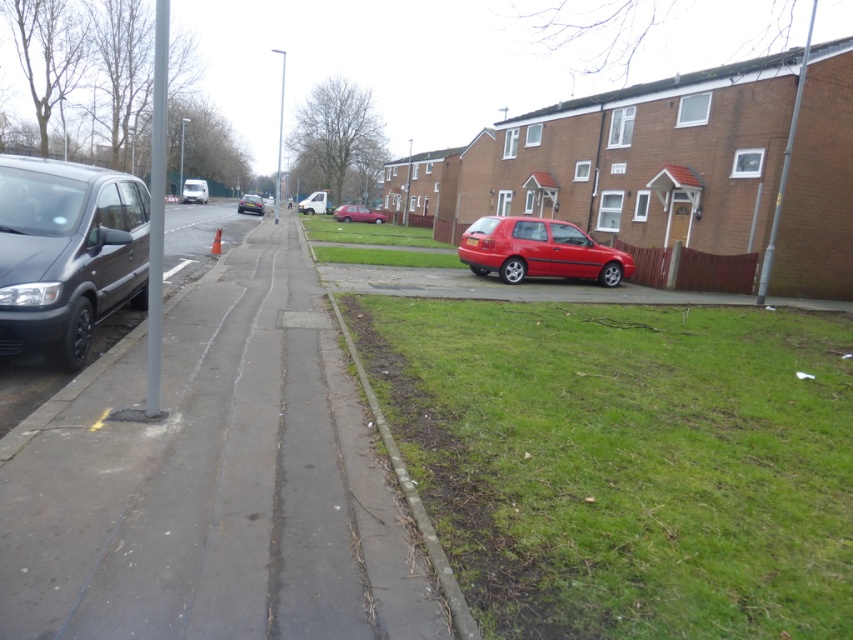
Which is behind, point (410, 467) or point (490, 248)?

The point (490, 248) is more distant.

Where is `green grass at lower right`? This screenshot has height=640, width=853. green grass at lower right is located at coordinates (625, 461).

Does concrete sidewalk at center have a lesser width compared to green grass at center?

Yes, concrete sidewalk at center is thinner than green grass at center.

Does concrete sidewalk at center have a lesser height compared to green grass at center?

Indeed, concrete sidewalk at center has a lesser height compared to green grass at center.

The height and width of the screenshot is (640, 853). Describe the element at coordinates (213, 481) in the screenshot. I see `concrete sidewalk at center` at that location.

Locate an element on the screen. concrete sidewalk at center is located at coordinates (213, 481).

Does green grass at lower right come in front of gravel at lower center?

That is False.

In the scene shown: Who is more distant from viewer, (827, 429) or (395, 460)?

The point (827, 429) is behind.

Which is behind, point (624, 349) or point (436, 540)?

The point (624, 349) is behind.

At what (x,y) coordinates should I click in order to perform the action: click on green grass at lower right. Please return your answer as a coordinate pair (x, y). Looking at the image, I should click on (625, 461).